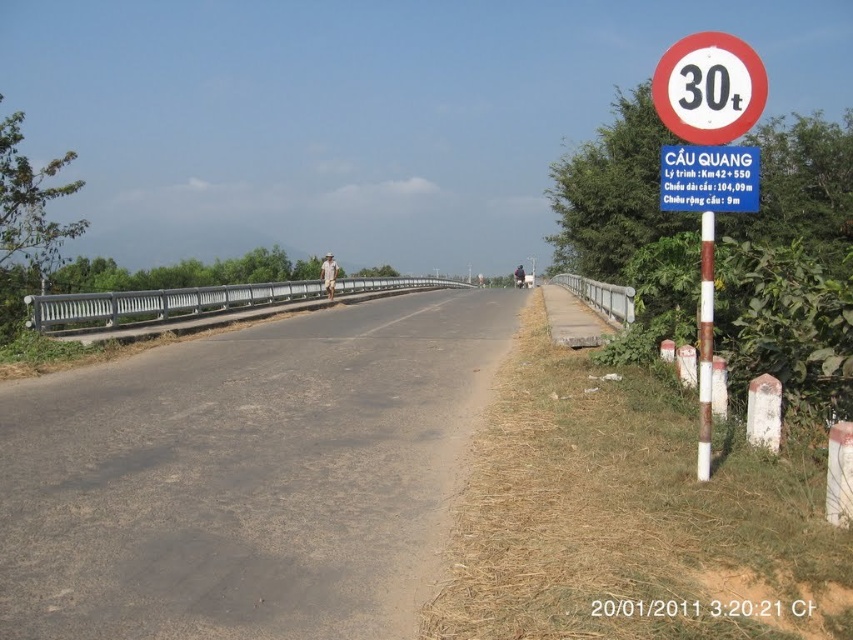
Question: Which object is farther from the camera taking this photo?

Choices:
 (A) black asphalt highway at center
 (B) white plastic sign at upper right
 (C) white plastic speed limit sign at upper right
 (D) silver metallic bridge at center

Answer: (D)

Question: Estimate the real-world distances between objects in this image. Which object is farther from the white plastic sign at right?

Choices:
 (A) black asphalt highway at center
 (B) white plastic speed limit sign at upper right
 (C) silver metallic bridge at center

Answer: (C)

Question: Can you confirm if white plastic sign at right is wider than white plastic speed limit sign at upper right?

Choices:
 (A) yes
 (B) no

Answer: (A)

Question: Which of the following is the closest to the observer?

Choices:
 (A) (202, 422)
 (B) (720, 196)
 (C) (213, 305)

Answer: (B)

Question: Is the position of white plastic sign at right less distant than that of white plastic sign at upper right?

Choices:
 (A) yes
 (B) no

Answer: (A)

Question: Is black asphalt highway at center wider than white plastic speed limit sign at upper right?

Choices:
 (A) yes
 (B) no

Answer: (A)